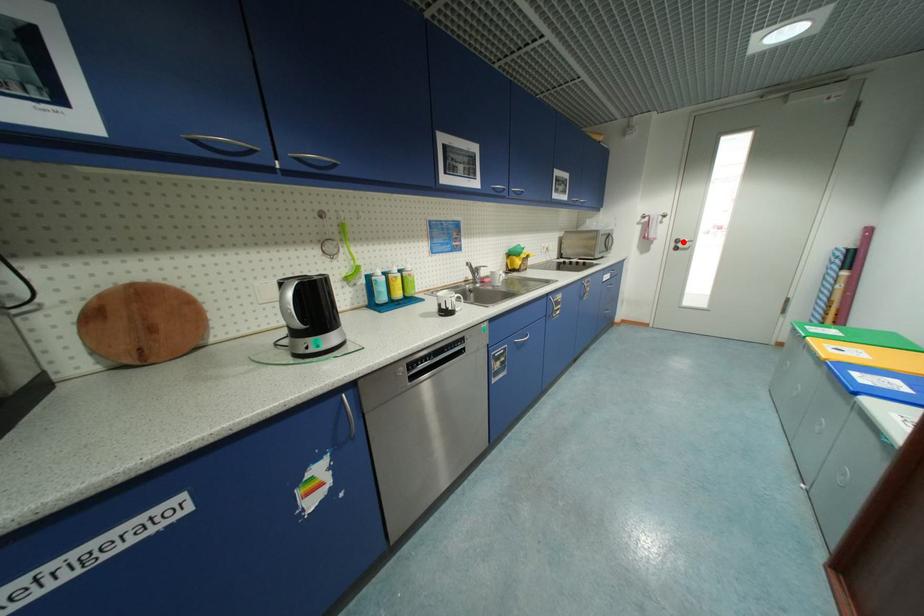
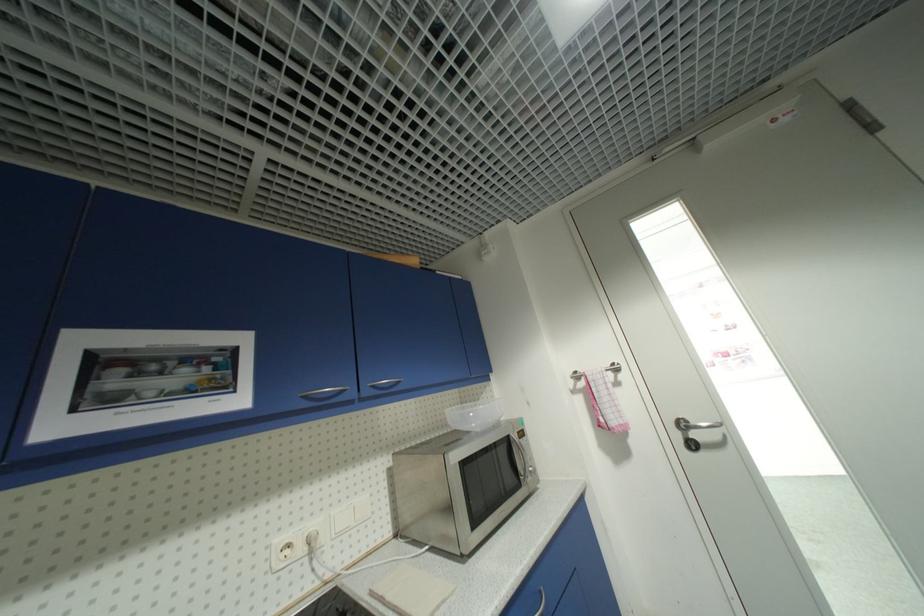
Locate, in the second image, the point that corresponds to the highlighted location in the first image.

(688, 426)